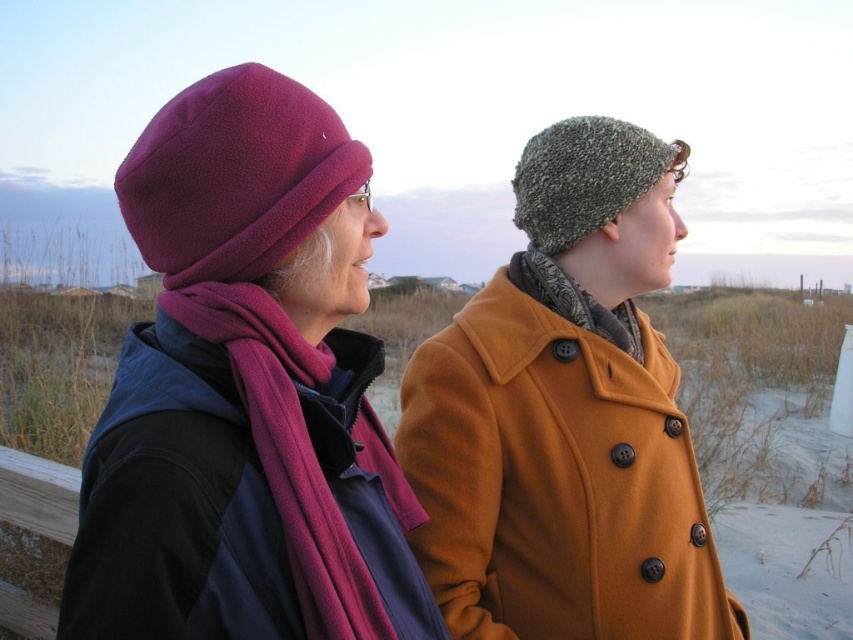
You are a tailor measuring the distance between two purple beanies on the left side of the image. The two beanies are labeled as matte purple beanie at left and fuzzy purple beanie at left. Given that the minimum required distance for proper storage is 12 inches, can both beanies be safely stored together?

The distance between the matte purple beanie at left and fuzzy purple beanie at left is 10.94 inches, which is less than the required 12 inches for proper storage. Therefore, they cannot be safely stored together.

You are a photographer trying to capture a photo of the fuzzy pink scarf at center without the fuzzy purple beanie at left blocking it. Based on their positions, can you adjust your angle to frame the scarf without the beanie obstructing it?

The fuzzy pink scarf at center is behind the fuzzy purple beanie at left, so adjusting your angle to focus on the scarf from a different perspective might allow you to capture it without the beanie blocking it.